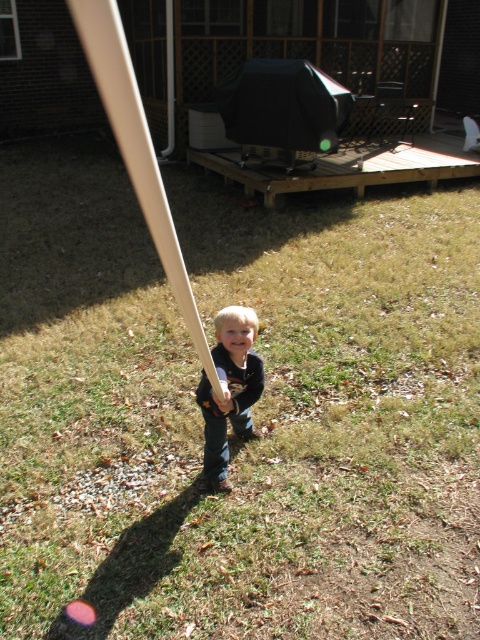
You are a baseball coach observing the scene. The baseball bat must be placed exactly at point 0.3, 0.3 to align with the pitching machine. Is the white matte baseball bat at center currently positioned correctly?

The white matte baseball bat at center is at point (139, 154), which is not exactly at (144, 192). Therefore, it is not positioned correctly to align with the pitching machine.

What object is located at the coordinates point (139, 154)?

The point (139, 154) corresponds to the white matte baseball bat at center.